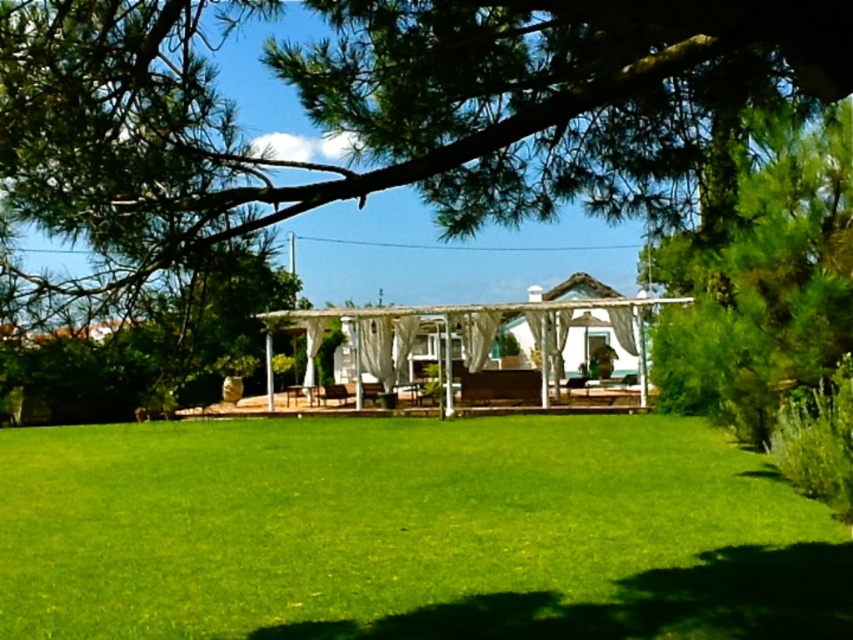
Question: Is green leafy tree at upper right bigger than white fabric gazebo at center?

Choices:
 (A) yes
 (B) no

Answer: (B)

Question: Can you confirm if green leafy tree at upper center is positioned to the right of white fabric gazebo at center?

Choices:
 (A) yes
 (B) no

Answer: (B)

Question: Which of the following is the farthest from the observer?

Choices:
 (A) (679, 621)
 (B) (492, 333)
 (C) (654, 72)

Answer: (B)

Question: Which point is closer to the camera?

Choices:
 (A) (476, 321)
 (B) (426, 90)
 (C) (851, 570)

Answer: (B)

Question: Estimate the real-world distances between objects in this image. Which object is closer to the white fabric gazebo at center?

Choices:
 (A) green leafy tree at upper right
 (B) green grass at center
 (C) green leafy tree at upper center

Answer: (A)

Question: From the image, what is the correct spatial relationship of green leafy tree at upper center in relation to green leafy tree at upper right?

Choices:
 (A) right
 (B) left

Answer: (B)